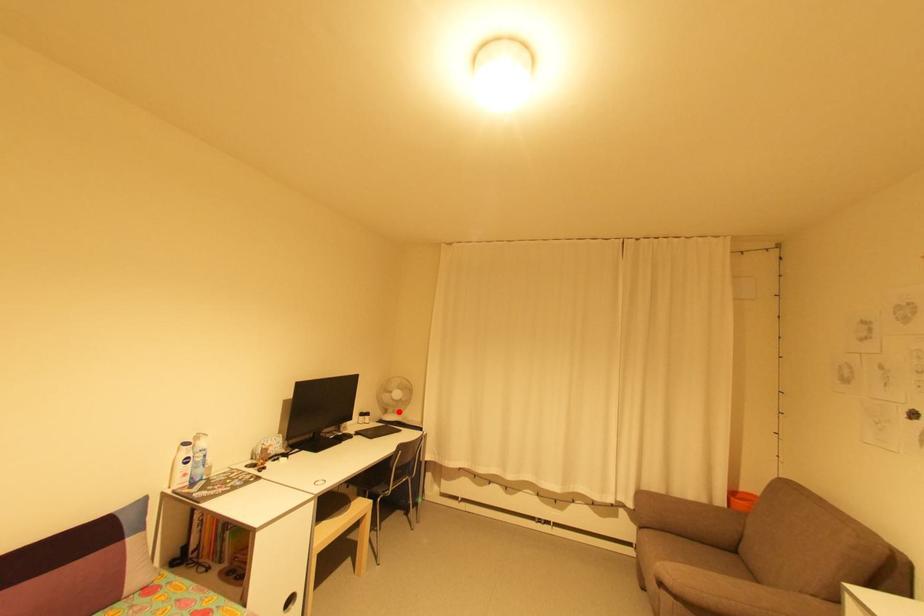
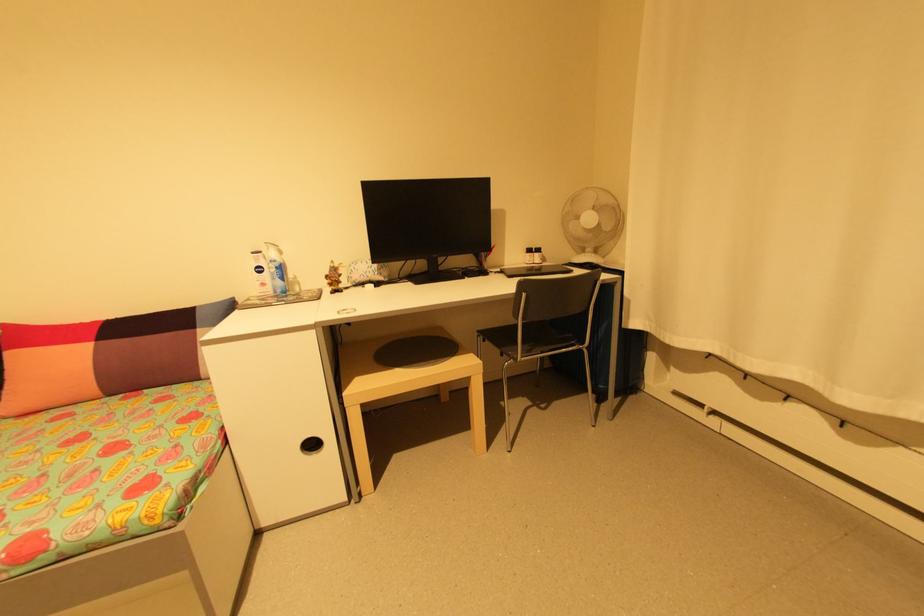
Question: I am providing you with two images of the same scene from different viewpoints. Given a red point in image1, look at the same physical point in image2. Is it:

Choices:
 (A) Closer to the viewpoint
 (B) Farther from the viewpoint

Answer: (A)